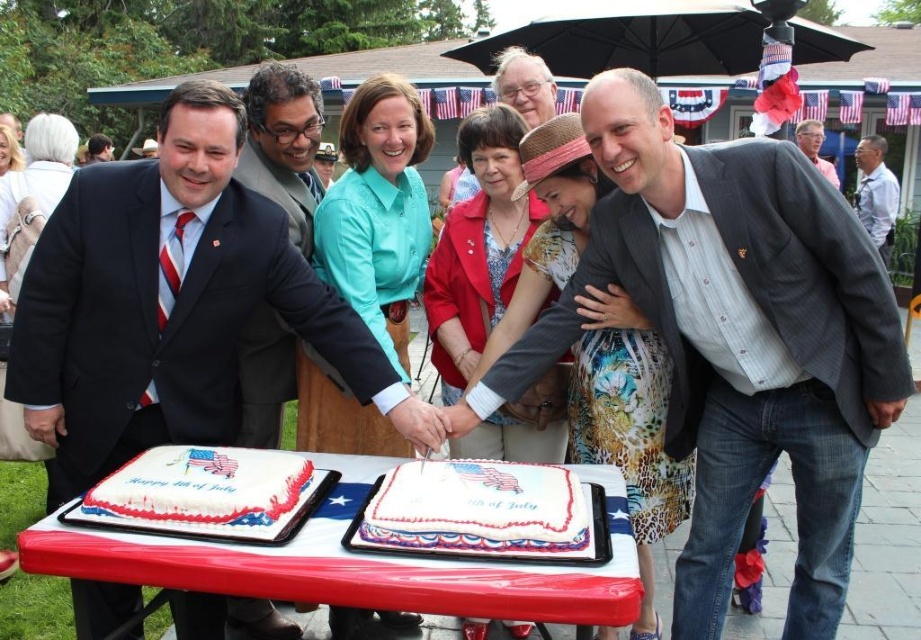
Does point (309, 508) come farther from viewer compared to point (867, 173)?

No, (309, 508) is in front of (867, 173).

Who is positioned more to the right, white frosted cake at lower left or gray shirt at upper right?

gray shirt at upper right is more to the right.

You are a GUI agent. You are given a task and a screenshot of the screen. Output one action in this format:
    pyautogui.click(x=<x>, y=<y>)
    Task: Click on the white frosted cake at lower left
    The height and width of the screenshot is (640, 921).
    Given the screenshot: What is the action you would take?
    pyautogui.click(x=207, y=493)

Is point (406, 604) positioned in front of point (803, 122)?

That is True.

Identify the location of white glossy table at center. The width and height of the screenshot is (921, 640). (356, 563).

Which is behind, point (332, 540) or point (803, 145)?

The point (803, 145) is behind.

At what (x,y) coordinates should I click in order to perform the action: click on white glossy table at center. Please return your answer as a coordinate pair (x, y). This screenshot has height=640, width=921. Looking at the image, I should click on (356, 563).

Who is positioned more to the right, matte black suit at left or shiny black suit at center?

From the viewer's perspective, shiny black suit at center appears more on the right side.

Can you confirm if matte black suit at left is taller than shiny black suit at center?

Indeed, matte black suit at left has a greater height compared to shiny black suit at center.

Who is more forward, [80,333] or [304,204]?

Point [80,333] is more forward.

Where is `matte black suit at left`? The width and height of the screenshot is (921, 640). matte black suit at left is located at coordinates (172, 301).